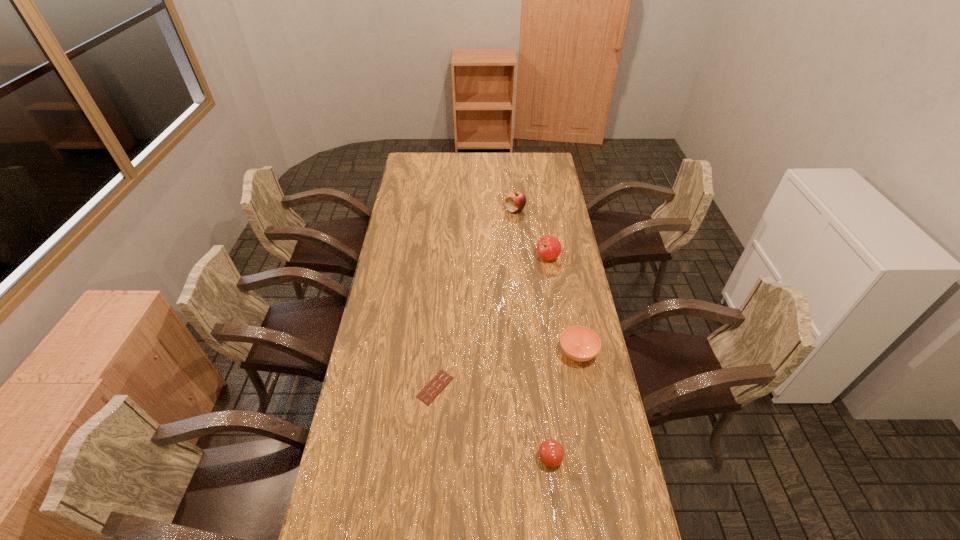
Identify the location of free spot that satisfies the following two spatial constraints: 1. on the front side of the leftmost object; 2. on the right side of the third tallest object. The height and width of the screenshot is (540, 960). (429, 458).

In order to click on vacant space that satisfies the following two spatial constraints: 1. on the back side of the shortest object; 2. on the left side of the second shortest object in this screenshot , I will do tap(438, 353).

This screenshot has width=960, height=540. What are the coordinates of `free space that satisfies the following two spatial constraints: 1. on the back side of the second nearest apple; 2. on the right side of the nearest apple` in the screenshot? It's located at (527, 258).

Locate an element on the screen. The height and width of the screenshot is (540, 960). free point that satisfies the following two spatial constraints: 1. on the back side of the leftmost object; 2. on the right side of the soup bowl is located at coordinates (438, 353).

This screenshot has height=540, width=960. In order to click on free spot that satisfies the following two spatial constraints: 1. on the back side of the farthest apple; 2. on the left side of the chocolate bar in this screenshot , I will do `click(449, 210)`.